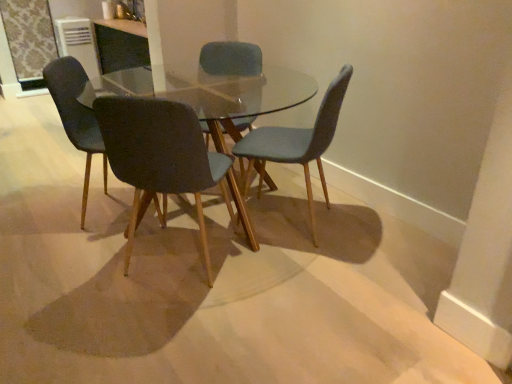
What are the coordinates of `free spot in front of matte black chair at left, the 4th chair positioned from the right` in the screenshot? It's located at (77, 256).